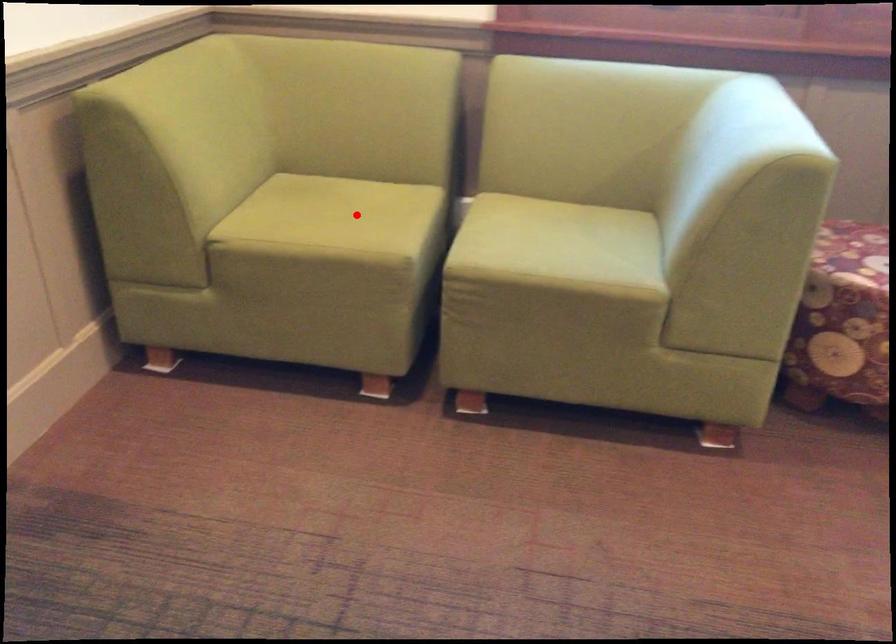
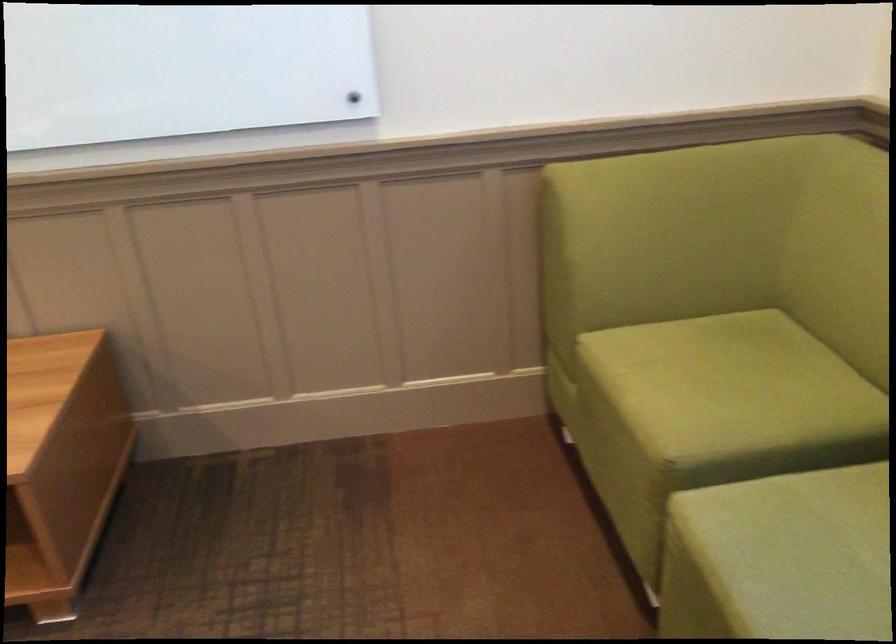
The point at the highlighted location is marked in the first image. Where is the corresponding point in the second image?

(727, 384)